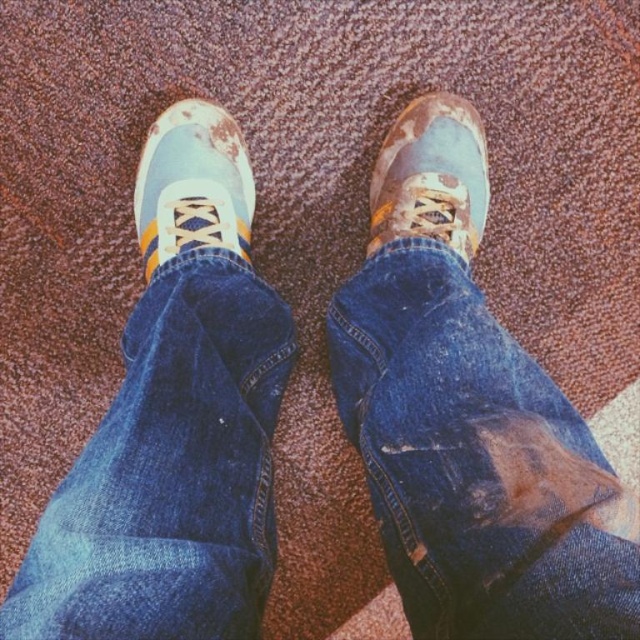
Is ripped denim jeans at lower right taller than matte blue sneaker at center?

Yes, ripped denim jeans at lower right is taller than matte blue sneaker at center.

Is ripped denim jeans at lower right in front of matte blue sneaker at center?

That is True.

Does point (376, 497) come farther from viewer compared to point (243, 202)?

No, it is in front of (243, 202).

The height and width of the screenshot is (640, 640). In order to click on ripped denim jeans at lower right in this screenshot , I will do `click(474, 461)`.

The width and height of the screenshot is (640, 640). Identify the location of matte blue sneaker at center. (193, 184).

Consider the image. Can you confirm if matte blue sneaker at center is bigger than blue suede sneaker at center?

Indeed, matte blue sneaker at center has a larger size compared to blue suede sneaker at center.

The width and height of the screenshot is (640, 640). I want to click on matte blue sneaker at center, so click(193, 184).

Find the location of a particular element. The width and height of the screenshot is (640, 640). matte blue sneaker at center is located at coordinates (193, 184).

Who is shorter, ripped denim jeans at lower right or blue suede sneaker at center?

Standing shorter between the two is blue suede sneaker at center.

Based on the photo, is ripped denim jeans at lower right below blue suede sneaker at center?

Indeed, ripped denim jeans at lower right is positioned under blue suede sneaker at center.

The width and height of the screenshot is (640, 640). What do you see at coordinates (474, 461) in the screenshot? I see `ripped denim jeans at lower right` at bounding box center [474, 461].

Identify the location of ripped denim jeans at lower right. The height and width of the screenshot is (640, 640). (474, 461).